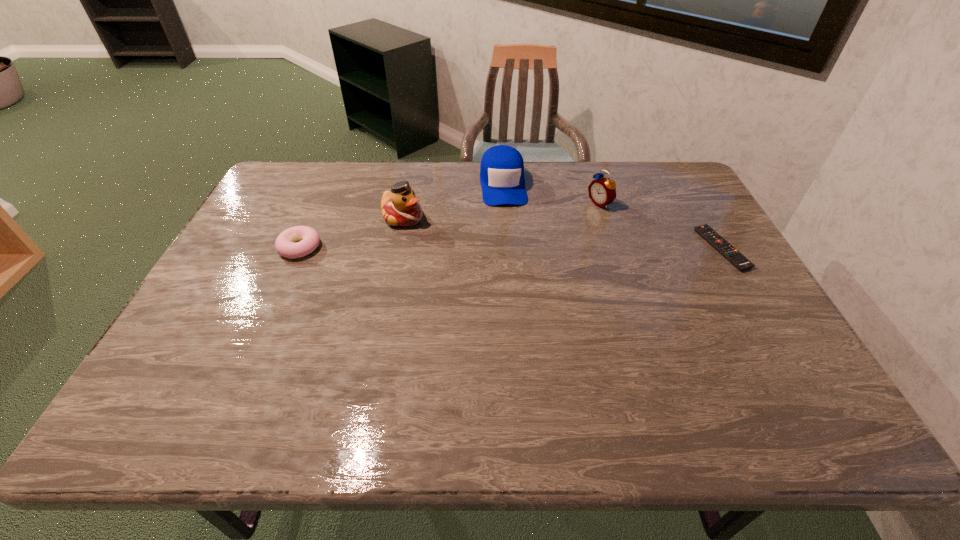
Locate an element on the screen. the leftmost object is located at coordinates (309, 239).

The image size is (960, 540). Find the location of `the fourth tallest object`. the fourth tallest object is located at coordinates (309, 239).

This screenshot has height=540, width=960. I want to click on remote control, so click(738, 260).

What are the coordinates of `the rightmost object` in the screenshot? It's located at (738, 260).

Find the location of a particular element. The height and width of the screenshot is (540, 960). baseball cap is located at coordinates (502, 179).

You are a GUI agent. You are given a task and a screenshot of the screen. Output one action in this format:
    pyautogui.click(x=<x>, y=<y>)
    Task: Click on the fourth object from left to right
    
    Given the screenshot: What is the action you would take?
    pyautogui.click(x=602, y=191)

In order to click on the second object from left to right in this screenshot , I will do `click(400, 207)`.

Find the location of a particular element. vacant space situated on the right of the doughnut is located at coordinates (389, 247).

Find the location of `vacant region located 0.290m on the back of the rightmost object`. vacant region located 0.290m on the back of the rightmost object is located at coordinates (679, 176).

Identify the location of vacant space positioned on the front-facing side of the baseball cap. Image resolution: width=960 pixels, height=540 pixels. (515, 277).